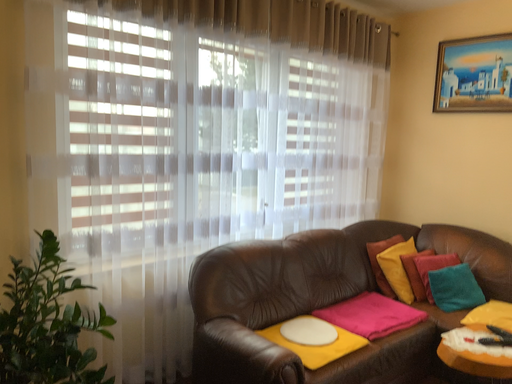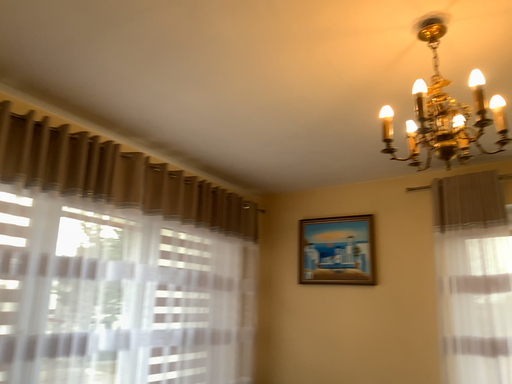
Question: How did the camera likely rotate when shooting the video?

Choices:
 (A) rotated left
 (B) rotated right

Answer: (B)